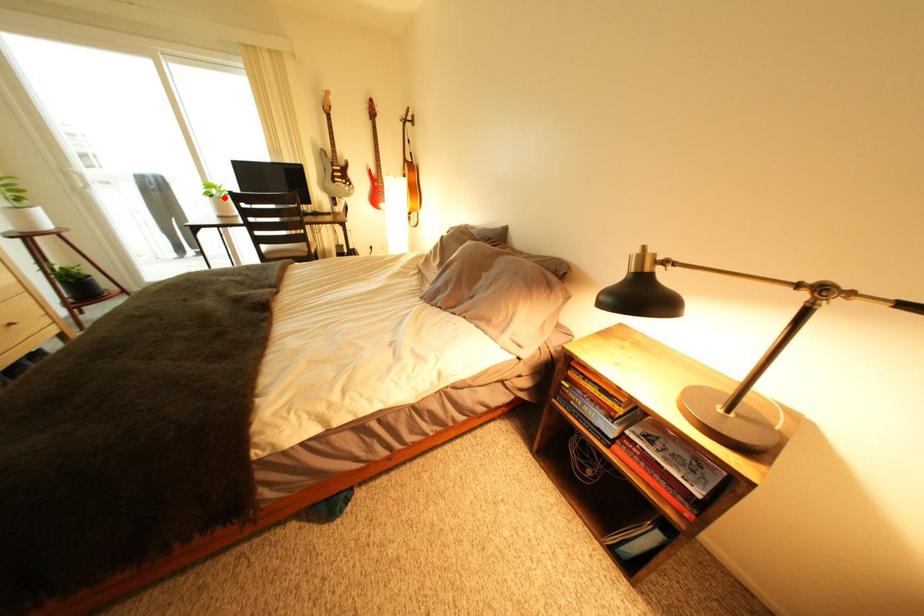
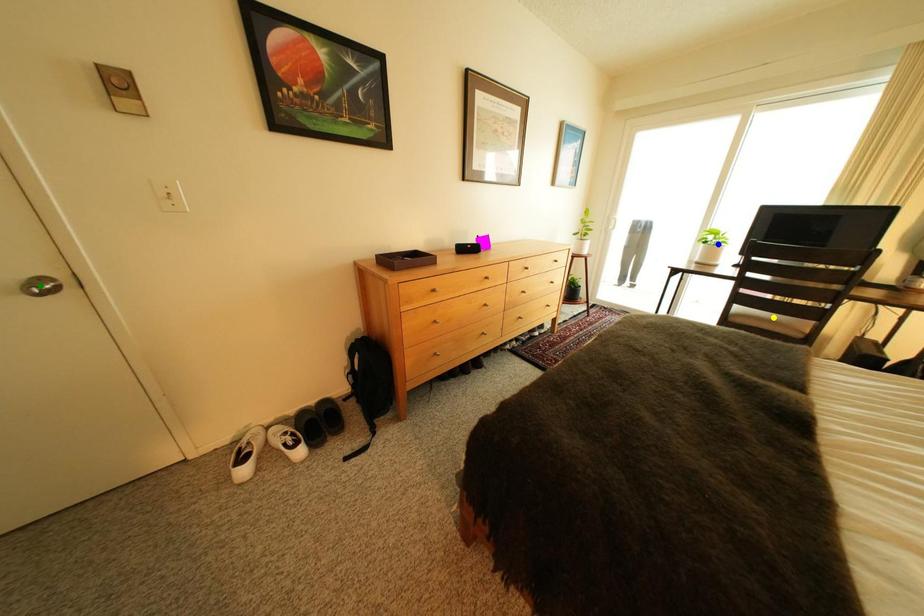
Question: I am providing you with two images of the same scene from different viewpoints. A red point is marked on the first image. You are given multiple points on the second image. Which point in image 2 represents the same 3d spot as the red point in image 1?

Choices:
 (A) blue point
 (B) yellow point
 (C) green point

Answer: (A)